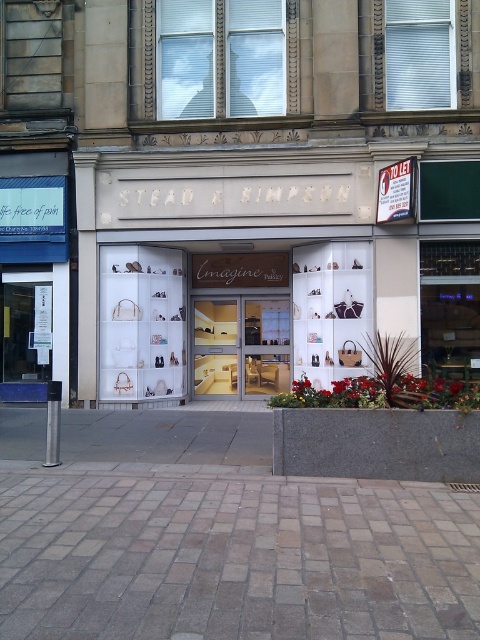
You are standing in front of the storefront and want to place a small potted plant between the brown brick pavement at lower center and the matte white display case at center. Based on their positions, which object should the plant be closer to?

The brown brick pavement at lower center is closer to the viewer than the matte white display case at center, so the plant should be placed closer to the matte white display case at center to be positioned between them.